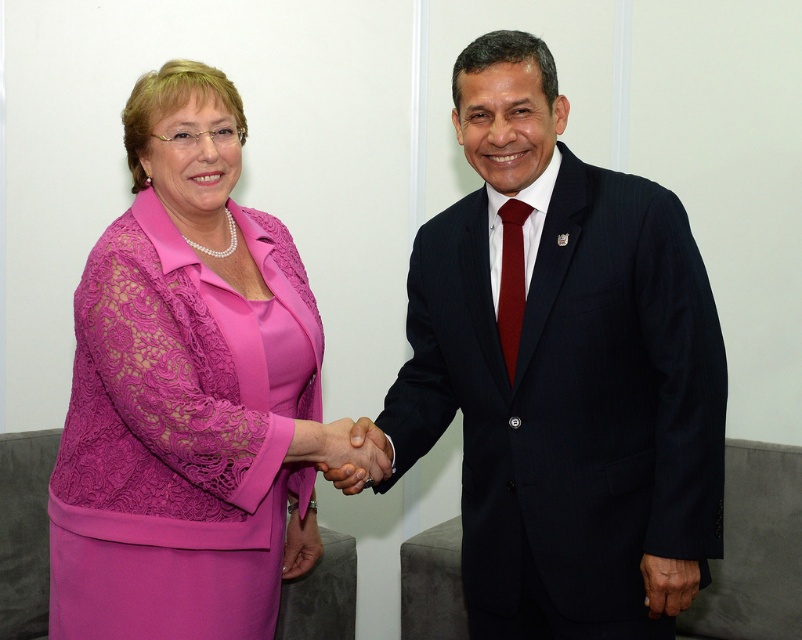
Question: Which of these objects is positioned closest to the pink fabric hand at center?

Choices:
 (A) dark blue pinstripe suit at center
 (B) matte pink dress at center

Answer: (B)

Question: Is matte pink dress at center further to the viewer compared to pink fabric hand at center?

Choices:
 (A) yes
 (B) no

Answer: (B)

Question: Which is farther from the dark blue pinstripe suit at center?

Choices:
 (A) matte pink dress at center
 (B) pink fabric hand at center

Answer: (B)

Question: Is smooth skin handshake at center to the left of pink fabric hand at center from the viewer's perspective?

Choices:
 (A) yes
 (B) no

Answer: (B)

Question: Which of the following is the closest to the observer?

Choices:
 (A) (306, 538)
 (B) (354, 440)

Answer: (B)

Question: Is dark blue pinstripe suit at center wider than pink fabric hand at center?

Choices:
 (A) no
 (B) yes

Answer: (B)